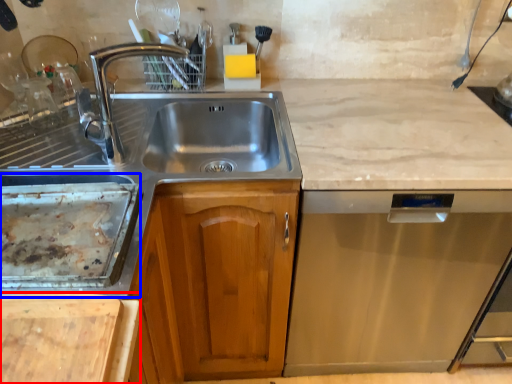
Question: Which object is closer to the camera taking this photo, cutting board (highlighted by a red box) or appliance (highlighted by a blue box)?

Choices:
 (A) cutting board
 (B) appliance

Answer: (A)